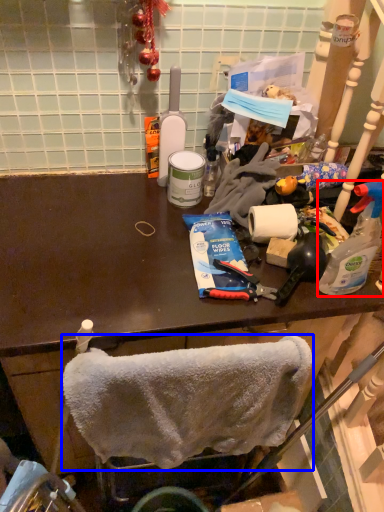
Question: Which of the following is the closest to the observer, bottle (highlighted by a red box) or towel/napkin (highlighted by a blue box)?

Choices:
 (A) bottle
 (B) towel/napkin

Answer: (B)